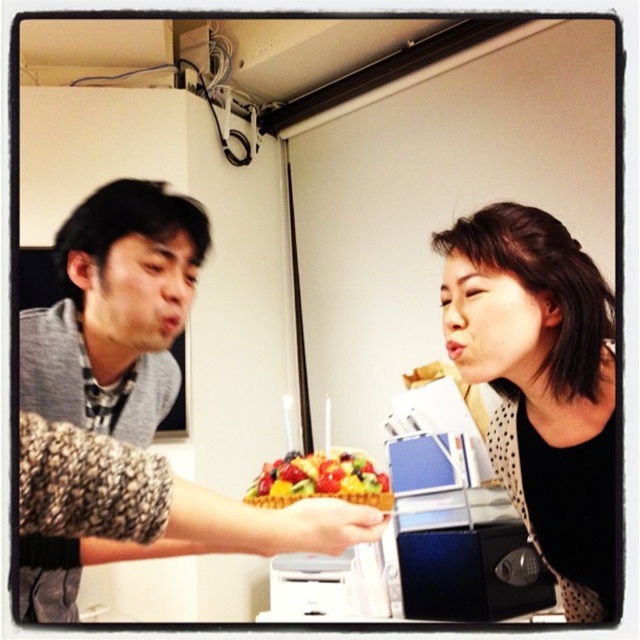
Question: Which point appears farthest from the camera in this image?

Choices:
 (A) (612, 442)
 (B) (372, 468)

Answer: (B)

Question: Can you confirm if matte black laptop at left is positioned to the right of black dotted blouse at right?

Choices:
 (A) yes
 (B) no

Answer: (B)

Question: Which object is farther from the camera taking this photo?

Choices:
 (A) black dotted blouse at right
 (B) gray knitted sweater at left
 (C) matte black laptop at left
 (D) glossy plastic fruit salad at center

Answer: (D)

Question: Estimate the real-world distances between objects in this image. Which object is closer to the black dotted blouse at right?

Choices:
 (A) glossy plastic fruit salad at center
 (B) matte black laptop at left

Answer: (B)

Question: Where is black dotted blouse at right located in relation to gray knitted sweater at left in the image?

Choices:
 (A) right
 (B) left

Answer: (A)

Question: Is matte black laptop at left positioned at the back of glossy plastic fruit salad at center?

Choices:
 (A) yes
 (B) no

Answer: (B)